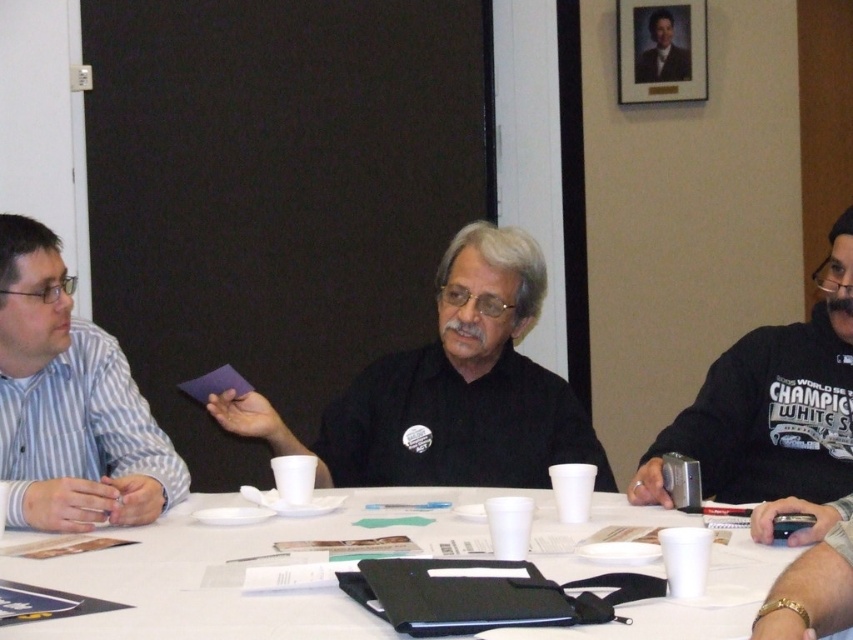
You are organizing a meeting and need to place a 10cm tall object on the surface of the white paper table at center. Considering the height of the striped cotton shirt at left, will the object fit without being obstructed?

The white paper table at center has a lesser height compared to striped cotton shirt at left. Since the table is shorter, placing a 10cm tall object on it may not be obstructed by the shirt, as the shirt is taller. However, the exact placement depends on the table dimensions and shirt position, but based on height alone, the object should fit.

You are sitting at the table in the scene and want to place a small object on the surface in front of the black matte shirt at center. Is the white paper table at center positioned correctly to allow this?

Yes, the white paper table at center is in front of the black matte shirt at center, so placing the object there would position it in front of the shirt.